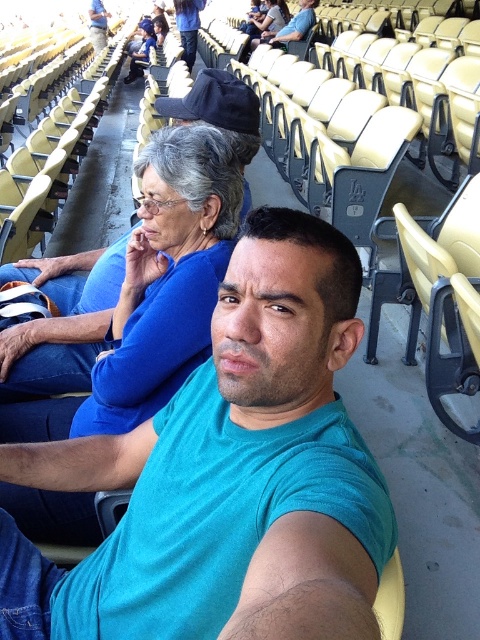
Question: Which of the following is the farthest from the observer?

Choices:
 (A) (193, 216)
 (B) (191, 422)

Answer: (A)

Question: Does teal matte t-shirt at center appear on the right side of blue fabric shirt at upper left?

Choices:
 (A) yes
 (B) no

Answer: (A)

Question: Does teal matte t-shirt at center appear on the left side of blue fabric shirt at upper left?

Choices:
 (A) no
 (B) yes

Answer: (A)

Question: Can you confirm if teal matte t-shirt at center is positioned to the right of blue fabric shirt at upper left?

Choices:
 (A) yes
 (B) no

Answer: (A)